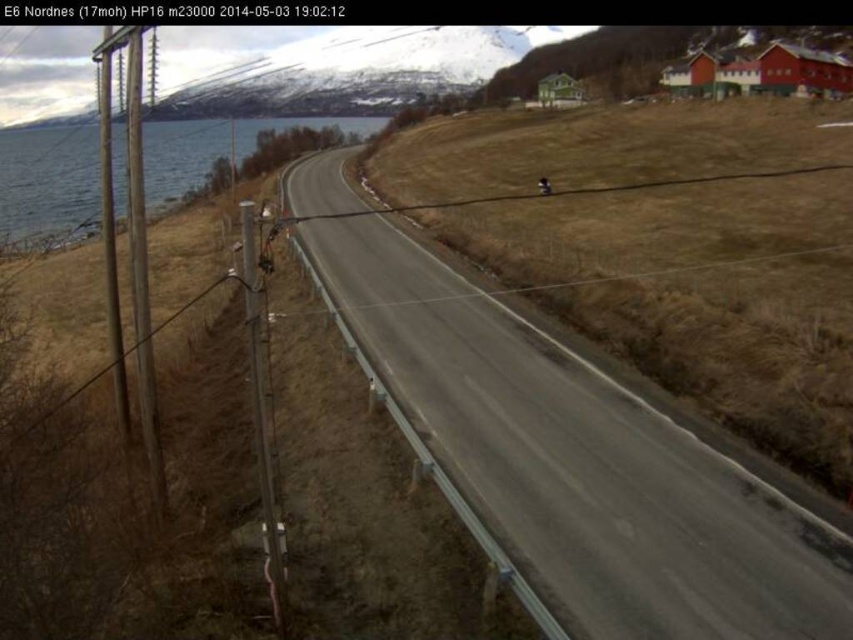
Based on the scene description, which object takes up more area in the image? Please choose between the gray asphalt highway at center and the blue water at left.

The blue water at left occupies more area than the gray asphalt highway at center according to the description.

You are standing at the camera position observing the road scene. There are two points marked on the road surface, namely point (x=341, y=300) and point (x=10, y=152). Which of these two points is nearer to your current position?

Point (x=341, y=300) is closer to the camera than point (x=10, y=152).

You are standing on the side of the road and want to take a photo of both the gray asphalt highway at center and the blue water at left. Which object should you focus on first to ensure both are in sharp focus?

You should focus on the gray asphalt highway at center first because it is closer to the viewer than the blue water at left. By focusing on the closer object, the depth of field may extend to include the farther object in acceptable focus.